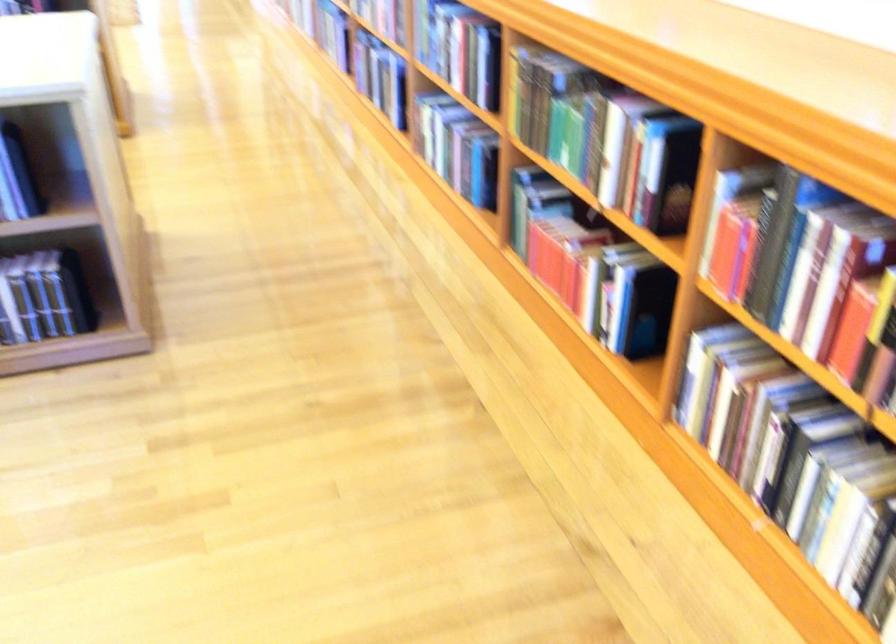
Question: Based on the continuous images, in which direction is the camera rotating? Reply with the corresponding letter.

Choices:
 (A) Left
 (B) Right
 (C) Up
 (D) Down

Answer: (B)